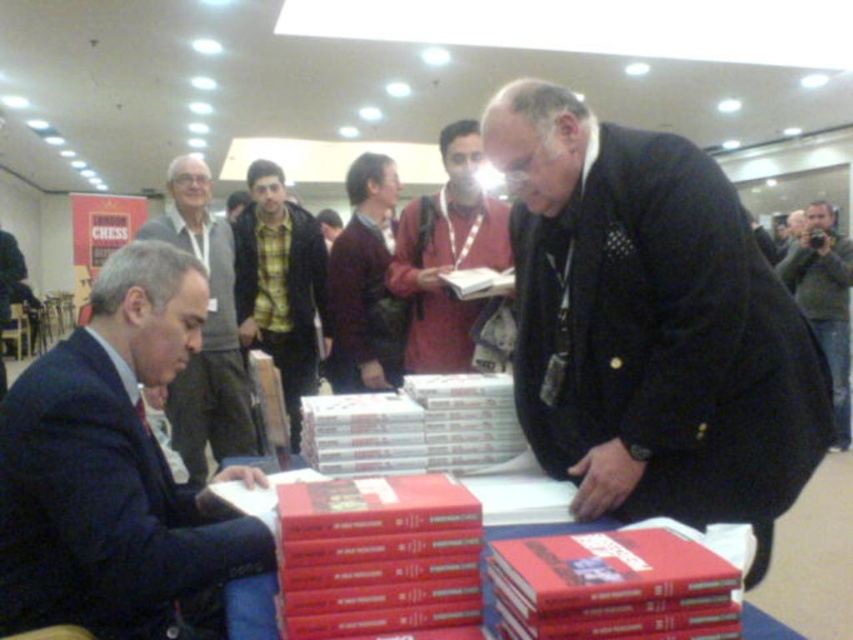
You are standing at the center of the room and see a point marked at coordinates (366, 284). What object is this point located on?

The point at coordinates (366, 284) is located on the maroon sweater at center.

You are organizing a photo shoot and need to place a backdrop behind each of the two subjects. The backdrop requires 1 meter of space between the subject and the backdrop. Given the space constraints in the room, can both the dark blue suit at left and the maroon sweater at center have their own backdrops placed 1 meter behind them?

The dark blue suit at left has a larger width than the maroon sweater at center. Since the backdrop requires 1 meter of space behind each subject, the larger width of the dark blue suit at left may require more space to accommodate the backdrop. However, the description only provides information about their widths, not the available space in the room. Without knowing the room dimensions, it is impossible to determine if both can have backdrops placed 1 meter behind them.

You are an event organizer at the book signing event. You need to determine which object is higher between the matte red jacket at center and the red paper at center. Can you tell me which one is taller?

The matte red jacket at center is taller than the red paper at center.